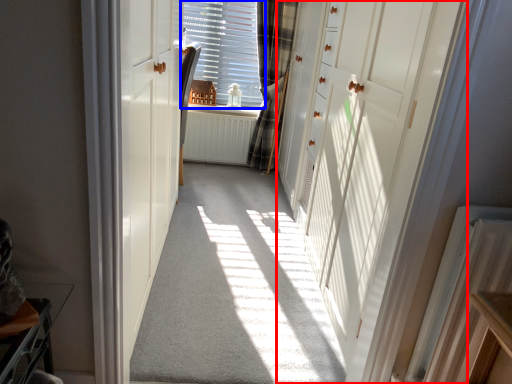
Question: Which object is further to the camera taking this photo, door (highlighted by a red box) or window (highlighted by a blue box)?

Choices:
 (A) door
 (B) window

Answer: (B)